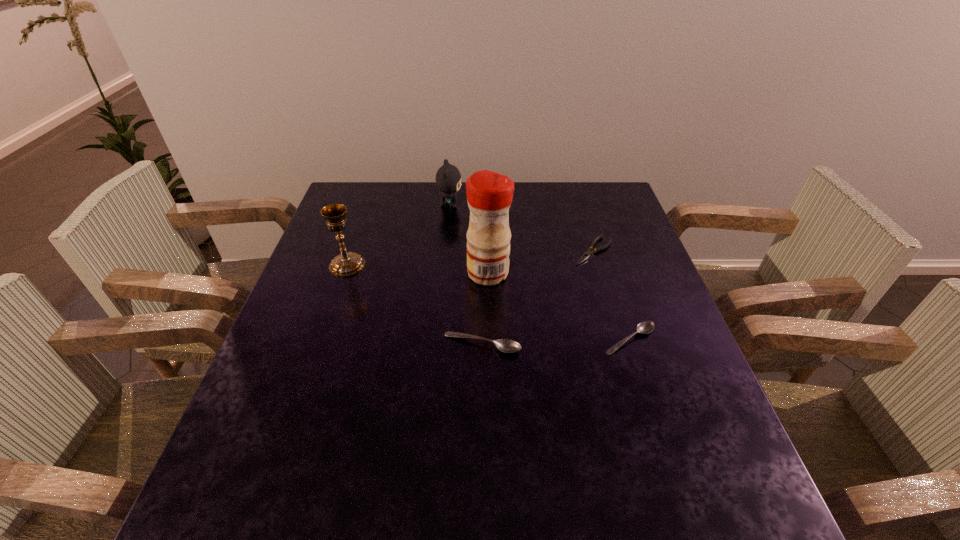
Find the location of a particular element. This screenshot has height=540, width=960. vacant area that satisfies the following two spatial constraints: 1. on the back side of the tallest object; 2. on the left side of the pliers is located at coordinates (488, 251).